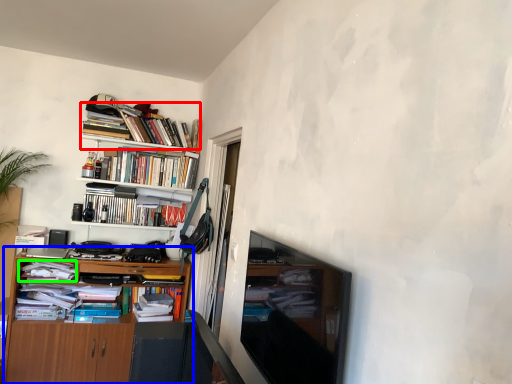
Question: Which is nearer to the book (highlighted by a red box)? cabinetry (highlighted by a blue box) or magazine (highlighted by a green box).

Choices:
 (A) cabinetry
 (B) magazine

Answer: (B)